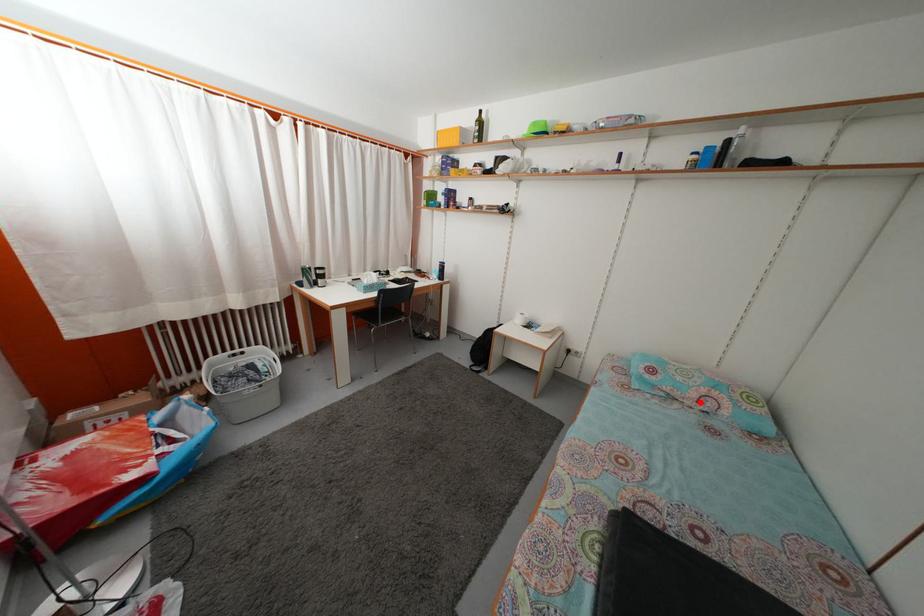
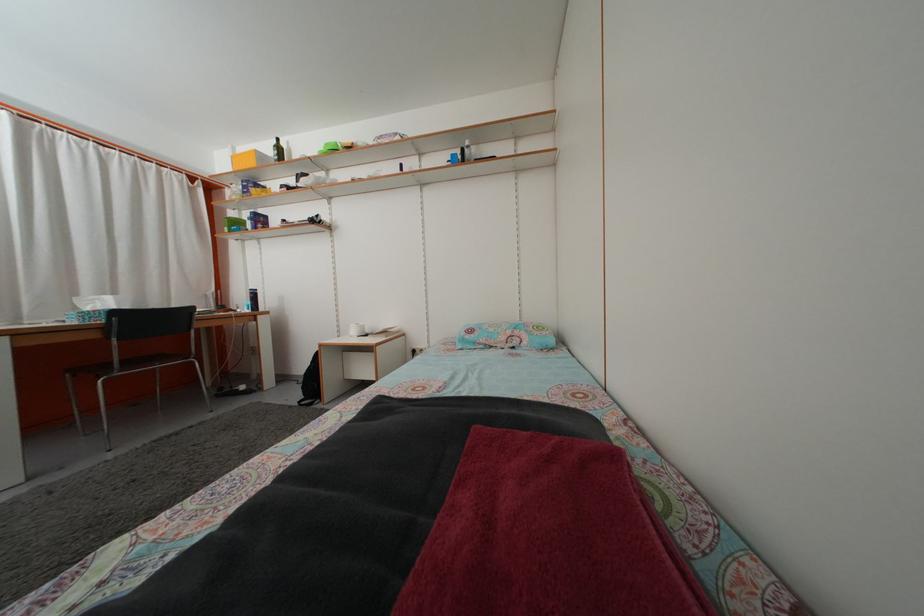
Locate, in the second image, the point that corresponds to the highlighted location in the first image.

(508, 346)